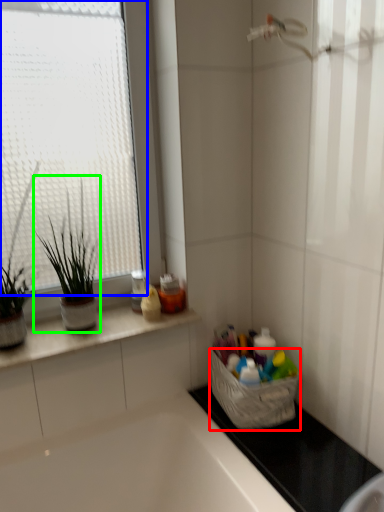
Question: Estimate the real-world distances between objects in this image. Which object is closer to basket (highlighted by a red box), window (highlighted by a blue box) or houseplant (highlighted by a green box)?

Choices:
 (A) window
 (B) houseplant

Answer: (B)